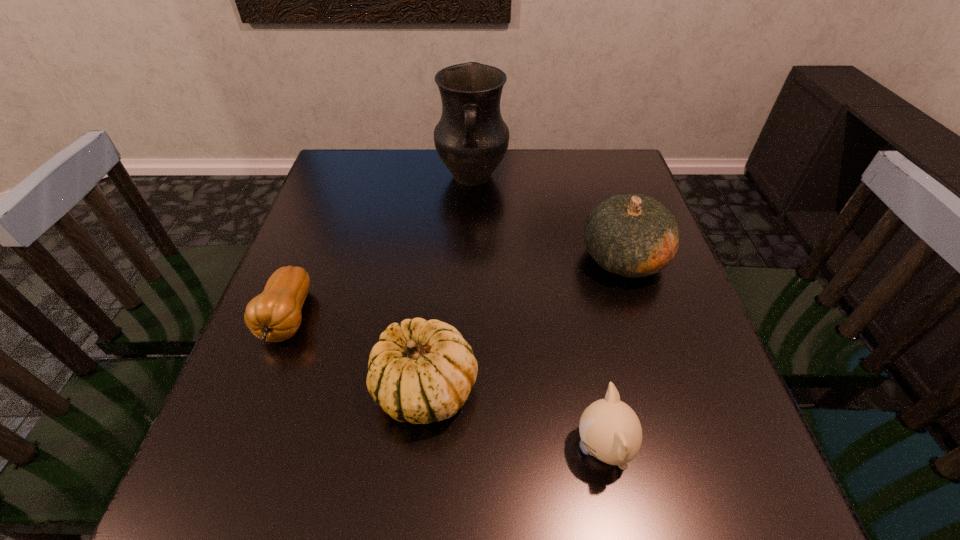
At what (x,y) coordinates should I click in order to perform the action: click on vacant space at the left edge of the desktop. Please return your answer as a coordinate pair (x, y). Image resolution: width=960 pixels, height=540 pixels. Looking at the image, I should click on (322, 386).

I want to click on free location at the right edge of the desktop, so click(692, 368).

Where is `free space at the far left corner of the desktop`? free space at the far left corner of the desktop is located at coordinates (327, 172).

At what (x,y) coordinates should I click in order to perform the action: click on blank region between the kitten and the tallest object. Please return your answer as a coordinate pair (x, y). The image size is (960, 540). Looking at the image, I should click on (538, 313).

Locate an element on the screen. This screenshot has height=540, width=960. vacant area between the rightmost gourd and the kitten is located at coordinates (613, 353).

What are the coordinates of `free point between the tallest object and the kitten` in the screenshot? It's located at [538, 313].

Identify the location of empty location between the rightmost gourd and the kitten. The image size is (960, 540). (613, 353).

Locate an element on the screen. The width and height of the screenshot is (960, 540). vacant space in between the tallest object and the rightmost gourd is located at coordinates (548, 218).

Find the location of a particular element. The width and height of the screenshot is (960, 540). unoccupied area between the rightmost gourd and the farthest object is located at coordinates 548,218.

Locate an element on the screen. free space that is in between the kitten and the farthest object is located at coordinates (538, 313).